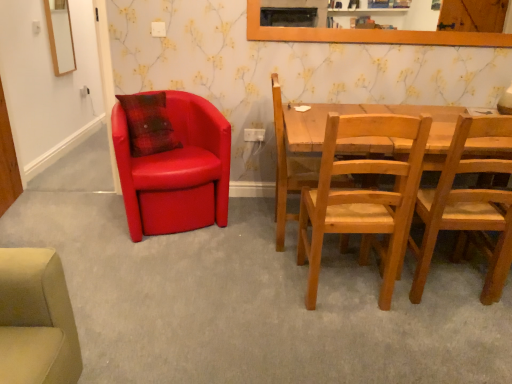
The width and height of the screenshot is (512, 384). What are the coordinates of `vacant space situated on the left part of wooden chair at center, positioned as the 3th chair in right-to-left order` in the screenshot? It's located at (238, 233).